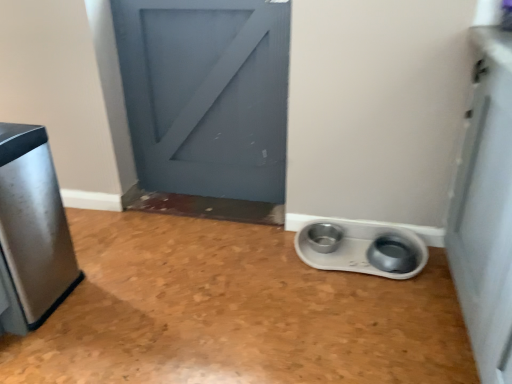
What do you see at coordinates (358, 248) in the screenshot? I see `white plastic pet bowls at lower right` at bounding box center [358, 248].

Measure the distance between point (x=342, y=243) and camera.

They are 6.01 feet apart.

Image resolution: width=512 pixels, height=384 pixels. In order to click on white plastic pet bowls at lower right in this screenshot , I will do `click(358, 248)`.

At what (x,y) coordinates should I click in order to perform the action: click on brushed metal trash can at left. Please return your answer as a coordinate pair (x, y). Looking at the image, I should click on (32, 230).

Image resolution: width=512 pixels, height=384 pixels. What do you see at coordinates (32, 230) in the screenshot? I see `brushed metal trash can at left` at bounding box center [32, 230].

The height and width of the screenshot is (384, 512). What are the coordinates of `white plastic pet bowls at lower right` in the screenshot? It's located at (358, 248).

Which object is positioned more to the left, white plastic pet bowls at lower right or brushed metal trash can at left?

From the viewer's perspective, brushed metal trash can at left appears more on the left side.

Does white plastic pet bowls at lower right lie in front of brushed metal trash can at left?

No, it is behind brushed metal trash can at left.

Is point (330, 233) in front of point (11, 176)?

No, (330, 233) is further to viewer.

From the image's perspective, which one is positioned higher, white plastic pet bowls at lower right or brushed metal trash can at left?

brushed metal trash can at left, from the image's perspective.

From a real-world perspective, is white plastic pet bowls at lower right beneath brushed metal trash can at left?

Yes, from a real-world perspective, white plastic pet bowls at lower right is below brushed metal trash can at left.

Which of these two, white plastic pet bowls at lower right or brushed metal trash can at left, is thinner?

With smaller width is white plastic pet bowls at lower right.

Looking at this image, considering the sizes of objects white plastic pet bowls at lower right and brushed metal trash can at left in the image provided, who is shorter, white plastic pet bowls at lower right or brushed metal trash can at left?

white plastic pet bowls at lower right is shorter.

In terms of size, does white plastic pet bowls at lower right appear bigger or smaller than brushed metal trash can at left?

In the image, white plastic pet bowls at lower right appears to be smaller than brushed metal trash can at left.

Can we say white plastic pet bowls at lower right lies outside brushed metal trash can at left?

white plastic pet bowls at lower right lies outside brushed metal trash can at left's area.

Based on the photo, is white plastic pet bowls at lower right with brushed metal trash can at left?

No.

Does white plastic pet bowls at lower right turn towards brushed metal trash can at left?

No, white plastic pet bowls at lower right is not aimed at brushed metal trash can at left.

Locate an element on the screen. appliance behind the brushed metal trash can at left is located at coordinates coord(358,248).

Between brushed metal trash can at left and white plastic pet bowls at lower right, which one appears on the left side from the viewer's perspective?

From the viewer's perspective, brushed metal trash can at left appears more on the left side.

Which object is closer to the camera taking this photo, brushed metal trash can at left or white plastic pet bowls at lower right?

brushed metal trash can at left is closer to the camera.

Between point (47, 195) and point (330, 239), which one is positioned in front?

Point (47, 195)

From the image's perspective, is brushed metal trash can at left over white plastic pet bowls at lower right?

Yes, from the image's perspective, brushed metal trash can at left is on top of white plastic pet bowls at lower right.

From a real-world perspective, is brushed metal trash can at left beneath white plastic pet bowls at lower right?

No.

Consider the image. Can you confirm if brushed metal trash can at left is thinner than white plastic pet bowls at lower right?

In fact, brushed metal trash can at left might be wider than white plastic pet bowls at lower right.

Who is taller, brushed metal trash can at left or white plastic pet bowls at lower right?

brushed metal trash can at left is taller.

Is brushed metal trash can at left bigger than white plastic pet bowls at lower right?

Yes.

Could white plastic pet bowls at lower right be considered to be inside brushed metal trash can at left?

No.

Are brushed metal trash can at left and white plastic pet bowls at lower right beside each other?

brushed metal trash can at left and white plastic pet bowls at lower right are clearly separated.

Is brushed metal trash can at left looking in the opposite direction of white plastic pet bowls at lower right?

No, brushed metal trash can at left is not facing the opposite direction of white plastic pet bowls at lower right.

This screenshot has height=384, width=512. Identify the location of appliance that appears below the brushed metal trash can at left (from the image's perspective). (358, 248).

Find the location of `appliance that appears on the right of brushed metal trash can at left`. appliance that appears on the right of brushed metal trash can at left is located at coordinates (358, 248).

Locate an element on the screen. Image resolution: width=512 pixels, height=384 pixels. home appliance in front of the white plastic pet bowls at lower right is located at coordinates (32, 230).